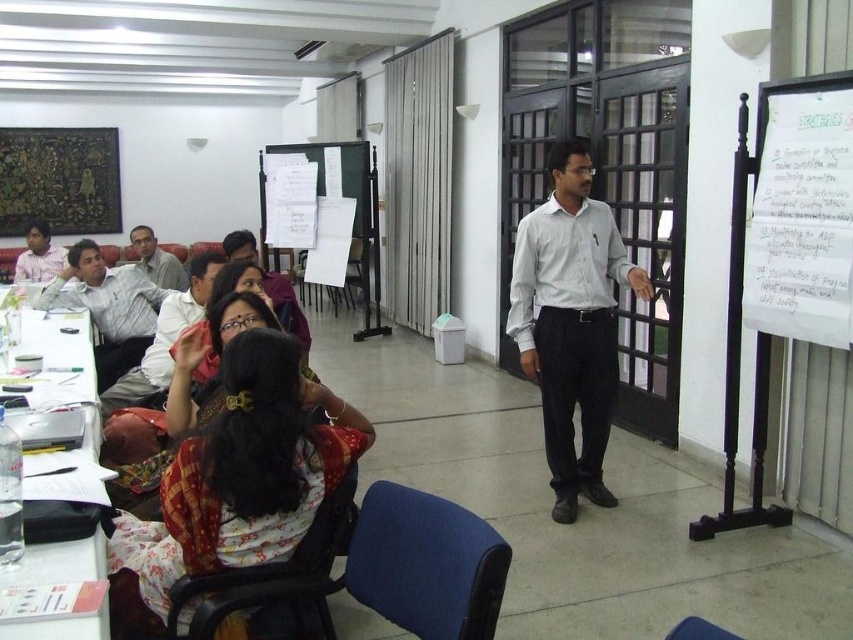
You are sitting in the audience and want to ask a question to the presenter. Which person should you direct your question to, the white striped shirt at center or the white shirt at upper left?

You should direct your question to the white striped shirt at center because they are the presenter standing at the front of the room, while the white shirt at upper left is likely an audience member sitting further back.

You are sitting in the conference room and want to walk from your current position to the point marked as point (x=68, y=570). However, there is an obstacle at point (x=47, y=259). Can you reach your destination without passing through the obstacle?

Point (x=68, y=570) is in front of point (x=47, y=259), so you can reach the destination without passing through the obstacle.

You are attending a meeting and need to identify who is the presenter. The presenter is the tallest person in the room. Based on the image, which of the following is the presenter? white striped shirt at center or white shirt at upper left?

The white striped shirt at center is much taller than the white shirt at upper left, so the presenter is the white striped shirt at center.